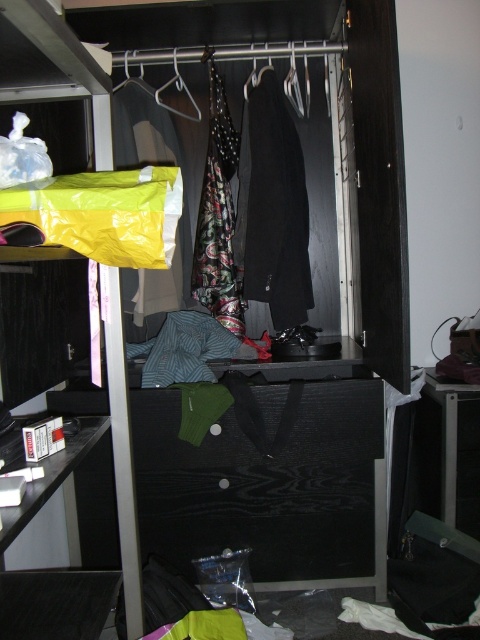
Question: Among these objects, which one is nearest to the camera?

Choices:
 (A) metallic silver hanger at center
 (B) black wool coat at center
 (C) black wood drawer at center
 (D) black fabric hanger at center

Answer: (C)

Question: From the image, what is the correct spatial relationship of black wood drawer at center in relation to black wool coat at center?

Choices:
 (A) above
 (B) below

Answer: (B)

Question: In this image, where is black wool coat at center located relative to black fabric hanger at center?

Choices:
 (A) below
 (B) above

Answer: (A)

Question: Can you confirm if black wood drawer at center is positioned above black wool coat at center?

Choices:
 (A) yes
 (B) no

Answer: (B)

Question: Which of the following is the closest to the observer?

Choices:
 (A) black fabric hanger at center
 (B) black wood drawer at center
 (C) metallic silver hanger at center

Answer: (B)

Question: Among these points, which one is nearest to the camera?

Choices:
 (A) (355, 524)
 (B) (219, 310)
 (C) (248, 76)
 (D) (297, 220)

Answer: (A)